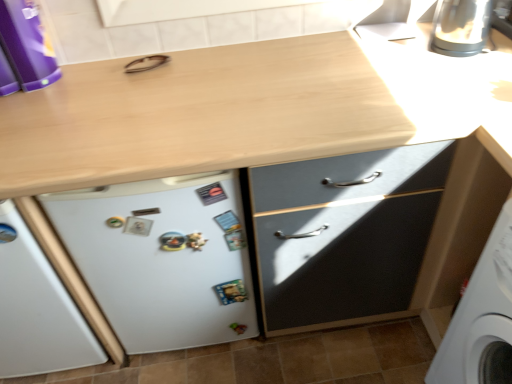
Identify the location of vacant area that lies in front of satin silver kettle at upper right. (473, 78).